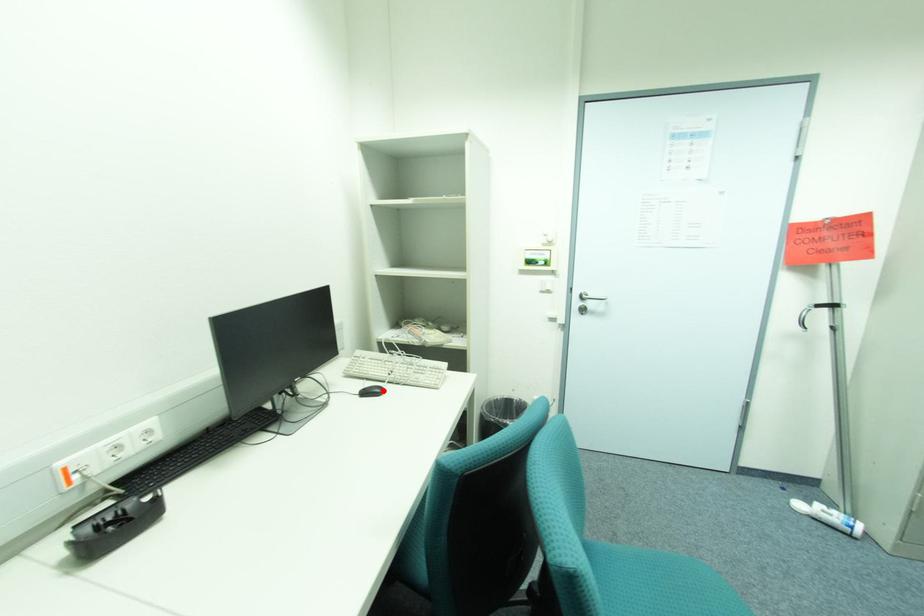
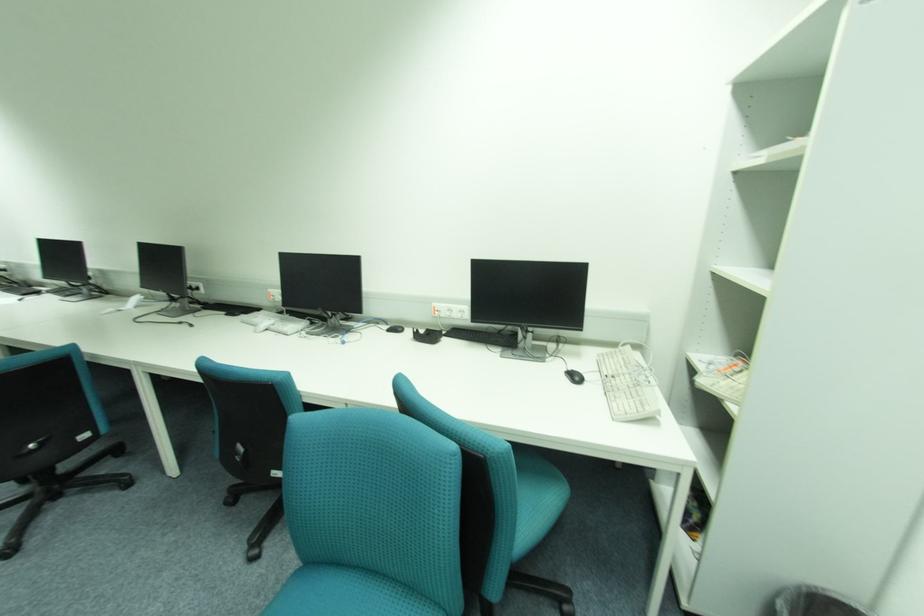
In the second image, find the point that corresponds to the highlighted location in the first image.

(584, 379)